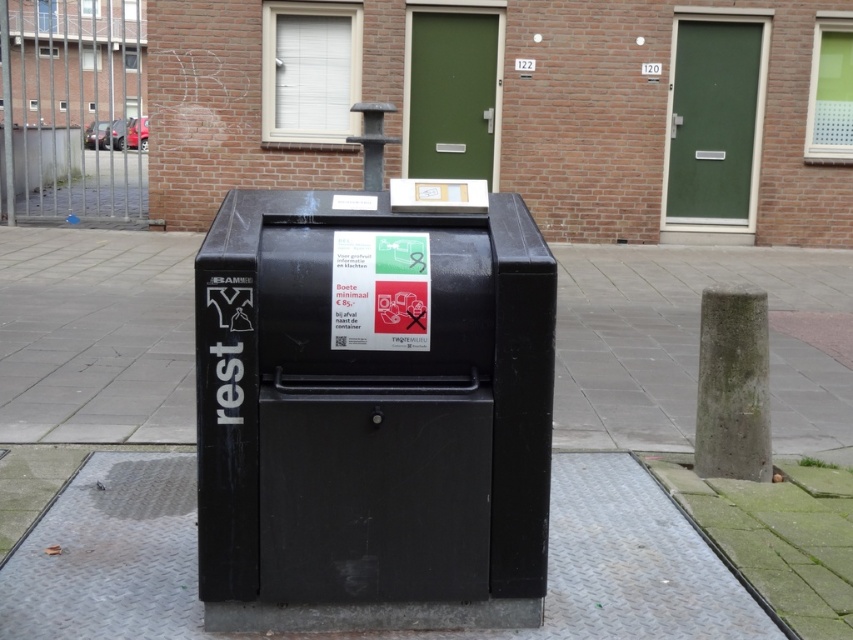
Question: Does black matte mailbox at center have a larger size compared to metallic gray pavement at lower center?

Choices:
 (A) no
 (B) yes

Answer: (A)

Question: Among these points, which one is nearest to the camera?

Choices:
 (A) (221, 435)
 (B) (61, 563)

Answer: (A)

Question: Does black matte mailbox at center come behind metallic gray pavement at lower center?

Choices:
 (A) yes
 (B) no

Answer: (B)

Question: Which point is closer to the camera?

Choices:
 (A) metallic gray pavement at lower center
 (B) black matte mailbox at center

Answer: (B)

Question: Does black matte mailbox at center have a larger size compared to metallic gray pavement at lower center?

Choices:
 (A) yes
 (B) no

Answer: (B)